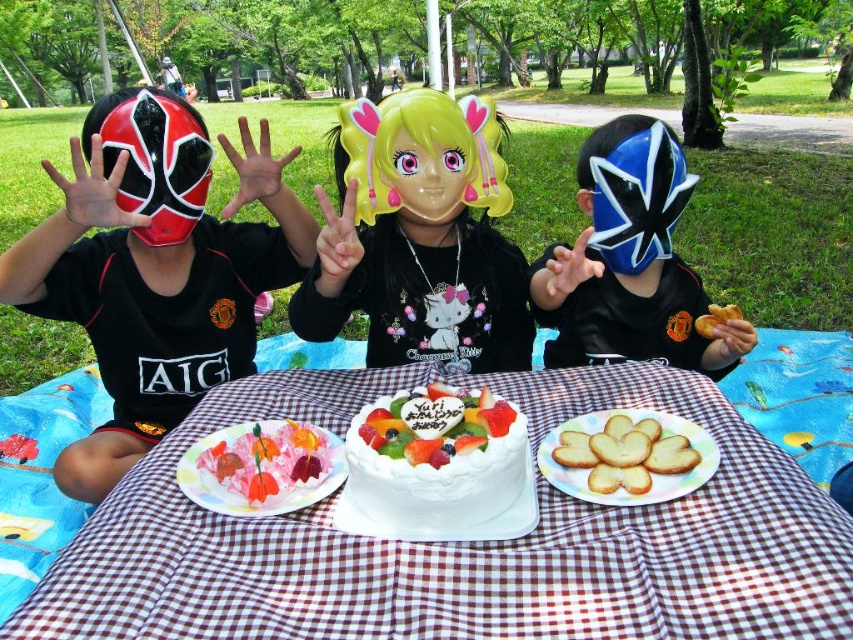
Question: Considering the real-world distances, which object is farthest from the blue matte mask at center?

Choices:
 (A) white checkered tablecloth at center
 (B) golden crispy cookies at center
 (C) pink glossy cake at center
 (D) golden crispy bread at center

Answer: (C)

Question: Can you confirm if white checkered tablecloth at center is thinner than golden crispy bread at center?

Choices:
 (A) no
 (B) yes

Answer: (A)

Question: Which point is closer to the camera taking this photo?

Choices:
 (A) (730, 310)
 (B) (360, 244)
 (C) (576, 486)

Answer: (C)

Question: Is pink glossy cake at center above glossy plastic mask at center?

Choices:
 (A) yes
 (B) no

Answer: (B)

Question: Among these points, which one is nearest to the camera?

Choices:
 (A) (459, 170)
 (B) (450, 525)

Answer: (B)

Question: Is white checkered tablecloth at center smaller than golden crispy cookies at center?

Choices:
 (A) no
 (B) yes

Answer: (A)